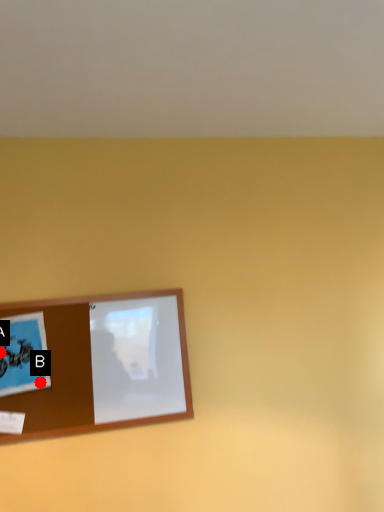
Question: Two points are circled on the image, labeled by A and B beside each circle. Which point is farther from the camera taking this photo?

Choices:
 (A) A is further
 (B) B is further

Answer: (A)